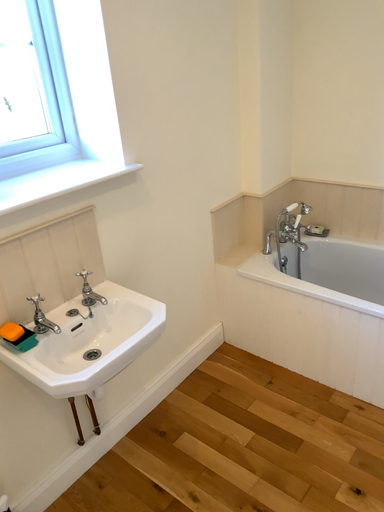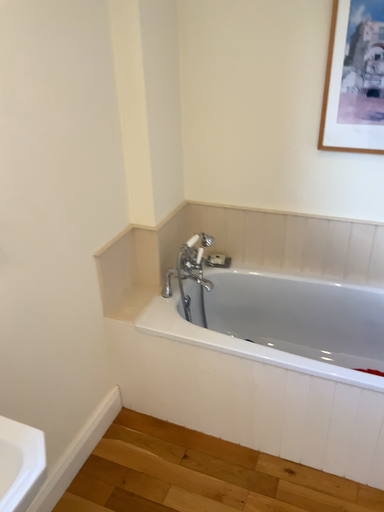
Question: How did the camera likely rotate when shooting the video?

Choices:
 (A) rotated right
 (B) rotated left

Answer: (A)